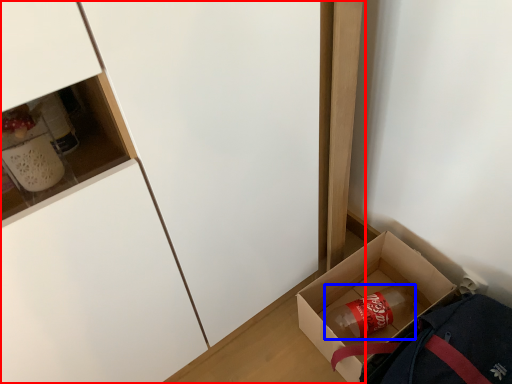
Question: Which of the following is the farthest to the observer, cabinetry (highlighted by a red box) or beverage (highlighted by a blue box)?

Choices:
 (A) cabinetry
 (B) beverage

Answer: (B)